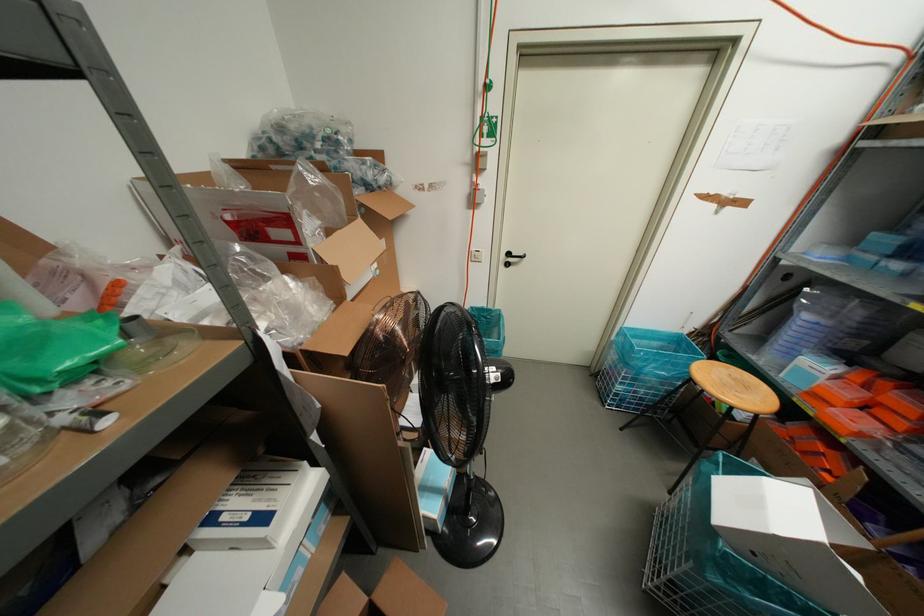
The width and height of the screenshot is (924, 616). Describe the element at coordinates (513, 257) in the screenshot. I see `a black door handle` at that location.